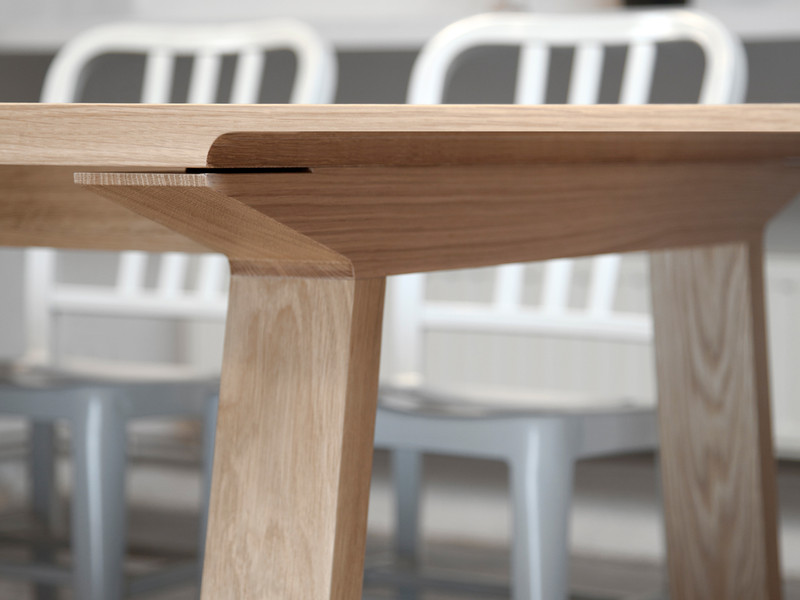
The image size is (800, 600). Identify the location of front chair leg. (534, 516), (93, 473).